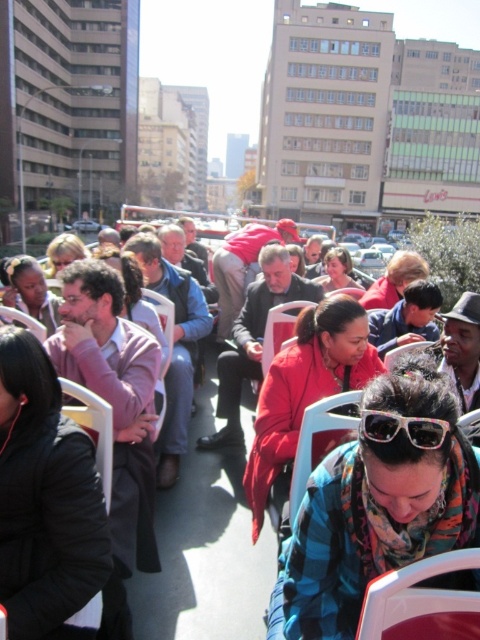
You are a photographer standing at the front of the open top bus. You want to take a photo of the matte black jacket at center. Where should you position yourself to capture it in the frame?

To capture the matte black jacket at center in the frame, position yourself at the front of the open top bus and aim your camera towards the center area where the matte black jacket is located at coordinates point (206, 541).

Based on the photo, you are a photographer carrying a camera. You want to take a photo of the matte black jacket at center from a distance that allows you to capture the entire jacket without zooming. If your camera has a minimum focusing distance of 3 meters, can you take the photo without moving closer?

The matte black jacket at center and camera are 2.86 meters apart. Since the minimum focusing distance is 3 meters, you are too close to capture the entire jacket without zooming. You need to move back to at least 3 meters.